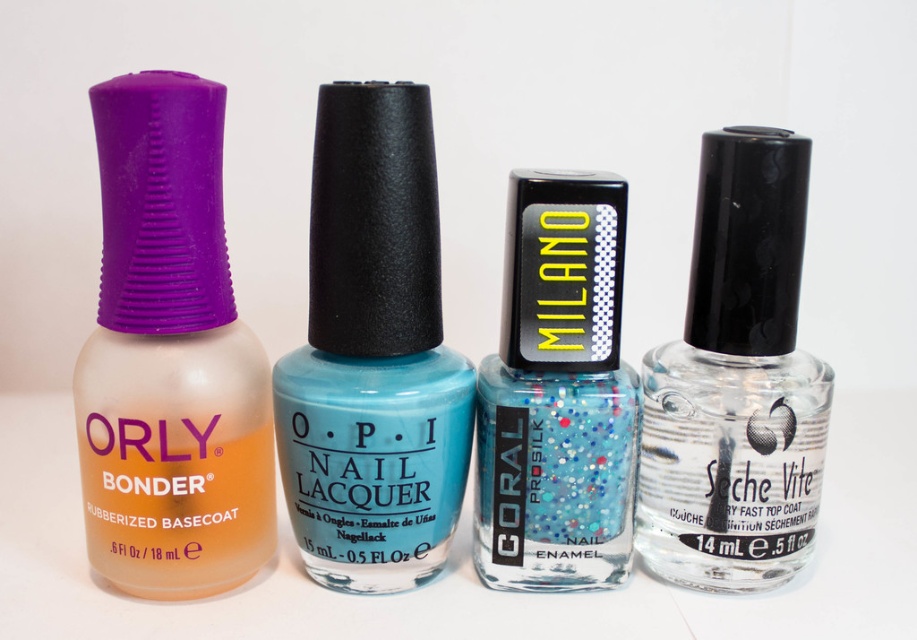
Between point (333, 516) and point (581, 438), which one is positioned in front?

Point (581, 438) is more forward.

At what (x,y) coordinates should I click in order to perform the action: click on teal glossy nail lacquer at center. Please return your answer as a coordinate pair (x, y). The image size is (917, 640). Looking at the image, I should click on (373, 353).

Which is in front, point (317, 172) or point (615, 579)?

Point (317, 172) is in front.

Identify the location of teal glossy nail lacquer at center. (373, 353).

Is matte orange nail polish at left in front of glittery blue nail enamel at center?

Yes, matte orange nail polish at left is closer to the viewer.

Is matte orange nail polish at left thinner than glittery blue nail enamel at center?

In fact, matte orange nail polish at left might be wider than glittery blue nail enamel at center.

The width and height of the screenshot is (917, 640). Describe the element at coordinates (169, 356) in the screenshot. I see `matte orange nail polish at left` at that location.

In order to click on matte orange nail polish at left in this screenshot , I will do `click(169, 356)`.

Is teal glossy nail lacquer at center to the left of clear glass nail polish at right from the viewer's perspective?

Yes, teal glossy nail lacquer at center is to the left of clear glass nail polish at right.

Who is higher up, teal glossy nail lacquer at center or clear glass nail polish at right?

Positioned higher is teal glossy nail lacquer at center.

The image size is (917, 640). What are the coordinates of `teal glossy nail lacquer at center` in the screenshot? It's located at (373, 353).